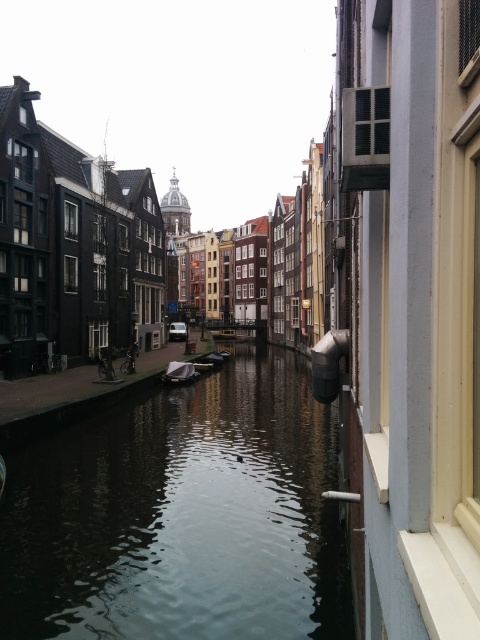
Based on the photo, you are a tourist planning to take a photo of the wooden boat at center from the edge of the dark reflective water at center. Considering the width of the water and the boat, will the boat fit entirely within the reflection of the water in your photo?

The dark reflective water at center has a larger width than the wooden boat at center, so the boat will fit entirely within the reflection of the water in your photo.

You are an architect designing a new building that needs to be visible from the canal. Based on the scene, which object between the dark reflective water at center and the metallic gray boat at center would allow a better view of the building from the water?

The dark reflective water at center is much taller than the metallic gray boat at center, so the building would be more visible from the water when viewed from the dark reflective water at center.